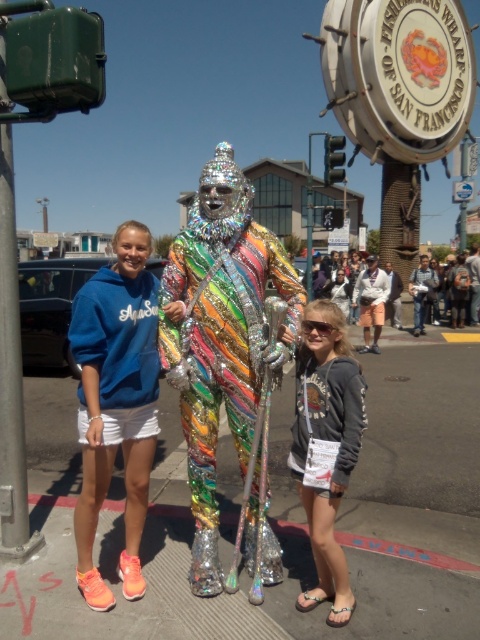
Is point (187, 419) less distant than point (154, 336)?

No, it is behind (154, 336).

Is holographic metallic costume at center to the left of blue cotton hoodie at center from the viewer's perspective?

No, holographic metallic costume at center is not to the left of blue cotton hoodie at center.

What do you see at coordinates (220, 336) in the screenshot?
I see `holographic metallic costume at center` at bounding box center [220, 336].

Where is `holographic metallic costume at center`? The width and height of the screenshot is (480, 640). holographic metallic costume at center is located at coordinates (220, 336).

Which is behind, point (332, 307) or point (344, 291)?

Point (344, 291)

What do you see at coordinates (328, 440) in the screenshot?
I see `gray hoodie at center` at bounding box center [328, 440].

This screenshot has height=640, width=480. What do you see at coordinates (328, 440) in the screenshot?
I see `gray hoodie at center` at bounding box center [328, 440].

This screenshot has height=640, width=480. What are the coordinates of `gray hoodie at center` in the screenshot? It's located at (328, 440).

Is point (407, 420) behind point (8, 515)?

Yes, it is.

Which is below, metallic reflective pavement at center or metallic pole at left?

metallic reflective pavement at center is lower down.

I want to click on metallic reflective pavement at center, so click(279, 518).